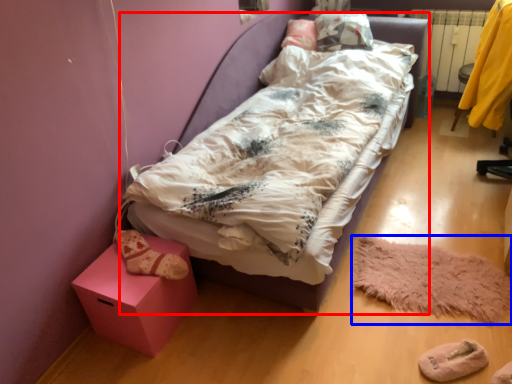
Question: Which of the following is the farthest to the observer, bed (highlighted by a red box) or mat (highlighted by a blue box)?

Choices:
 (A) bed
 (B) mat

Answer: (B)